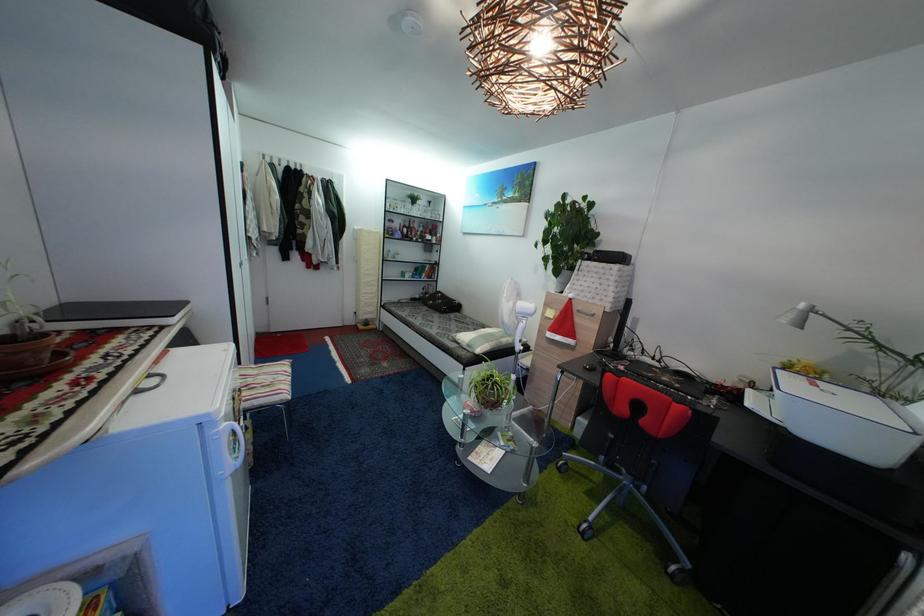
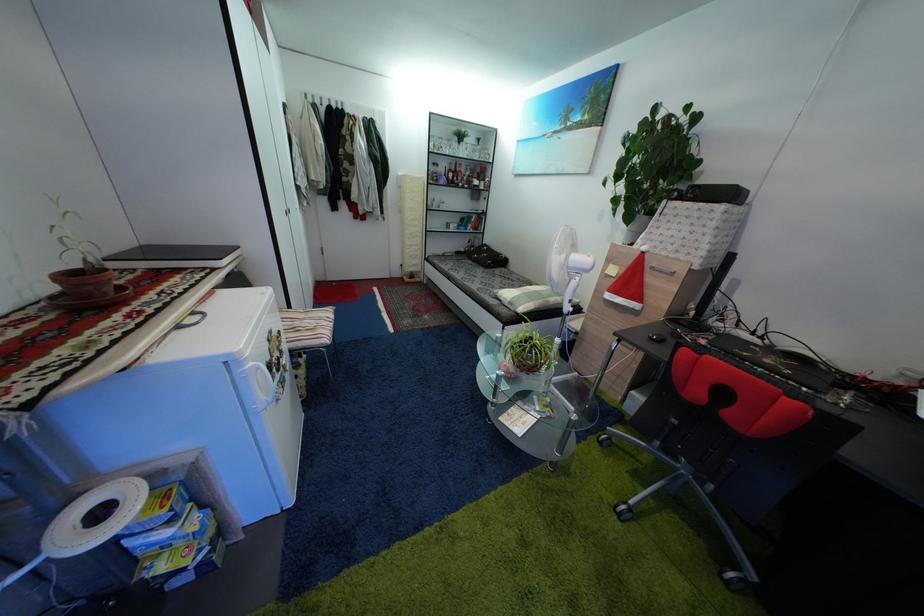
Locate, in the second image, the point that corresponds to (x=477, y=353) in the first image.

(517, 310)